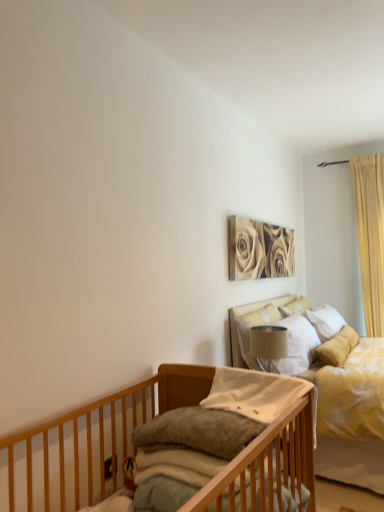
Identify the location of vacant space underneath sepia-toned canvas at upper center (from a real-world perspective). Image resolution: width=384 pixels, height=512 pixels. (260, 296).